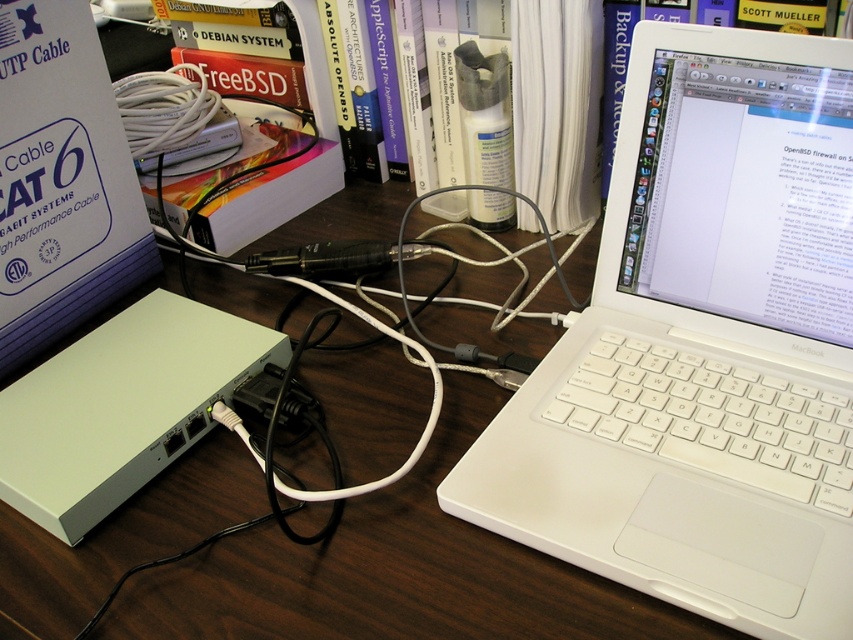
Between white plastic laptop at center and wooden table at center, which one appears on the right side from the viewer's perspective?

Positioned to the right is white plastic laptop at center.

Which is above, white plastic laptop at center or wooden table at center?

Positioned higher is white plastic laptop at center.

Where is `white plastic laptop at center`? This screenshot has height=640, width=853. white plastic laptop at center is located at coordinates (701, 348).